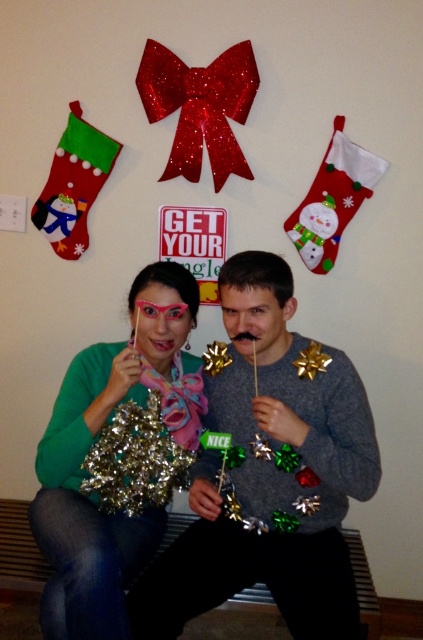
From the picture: You are a photographer setting up for a group photo. You need to ensure that the gray sweater at center and the metallic gold tinsel at left are both visible in the frame. Based on their heights, which object should you adjust the camera angle to focus on first?

The gray sweater at center has a greater height compared to the metallic gold tinsel at left, so you should focus on the gray sweater at center first to ensure it is properly framed before adjusting for the lower metallic gold tinsel at left.

You are standing in the festive indoor setting and want to place a decoration between the two points labeled point (291, 538) and point (192, 324). Which point should the decoration be closer to in order to be positioned in front of the other?

The decoration should be closer to point (291, 538) because it is in front of point (192, 324).

You are a photographer at this festive event and need to position a light to the left of the metallic gold tinsel at left. Will the light also be to the left of the gray sweater at center?

The gray sweater at center is to the right of the metallic gold tinsel at left, so placing the light to the left of the metallic gold tinsel at left would mean it is also to the left of the gray sweater at center.